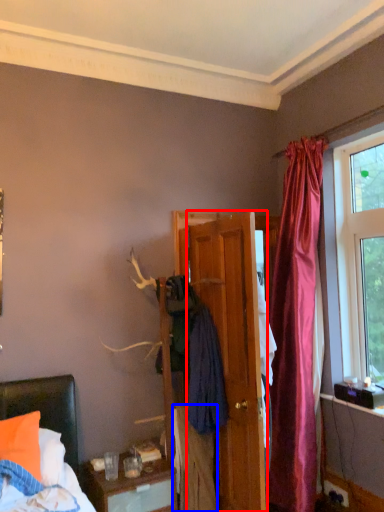
Question: Which object appears closest to the camera in this image, door (highlighted by a red box) or clothing (highlighted by a blue box)?

Choices:
 (A) door
 (B) clothing

Answer: (A)